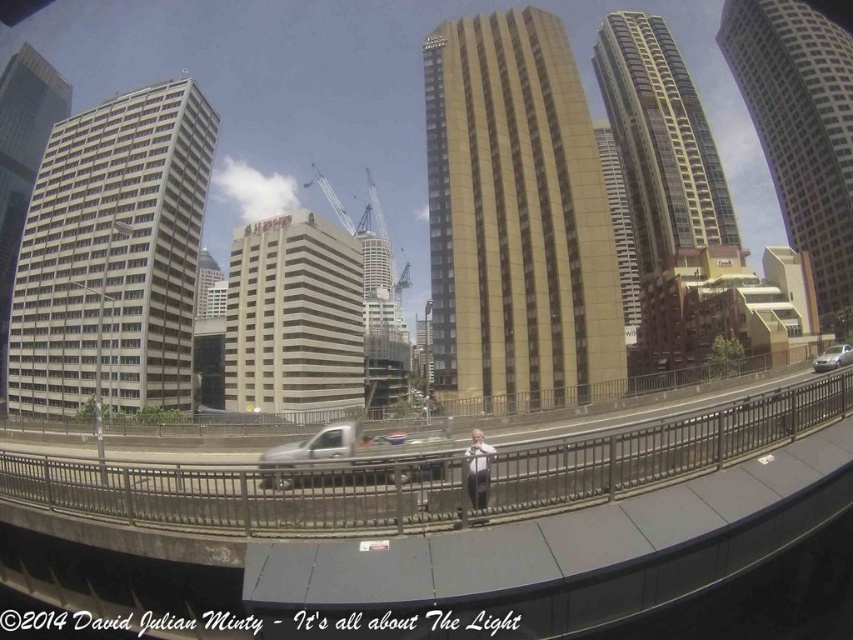
Question: Is concrete at center bigger than light gray suit at center?

Choices:
 (A) no
 (B) yes

Answer: (B)

Question: Where is concrete at center located in relation to light gray suit at center in the image?

Choices:
 (A) below
 (B) above

Answer: (B)

Question: Can you confirm if silver metallic truck at center is positioned to the left of silver metallic sedan at right?

Choices:
 (A) yes
 (B) no

Answer: (A)

Question: Considering the real-world distances, which object is closest to the silver metallic truck at center?

Choices:
 (A) metallic gray crane at center
 (B) silver metallic sedan at right

Answer: (B)

Question: Estimate the real-world distances between objects in this image. Which object is farther from the silver metallic truck at center?

Choices:
 (A) metallic gray crane at center
 (B) light gray suit at center
 (C) silver metallic sedan at right
 (D) concrete at center

Answer: (A)

Question: Estimate the real-world distances between objects in this image. Which object is farther from the metallic gray crane at center?

Choices:
 (A) silver metallic truck at center
 (B) silver metallic sedan at right

Answer: (A)